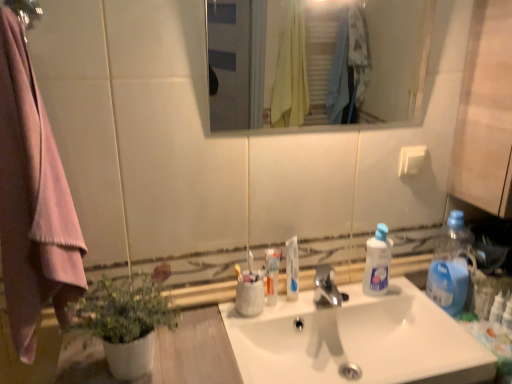
This screenshot has height=384, width=512. What are the coordinates of `vacant area located to the right-hand side of green matte plant at lower left` in the screenshot? It's located at (211, 355).